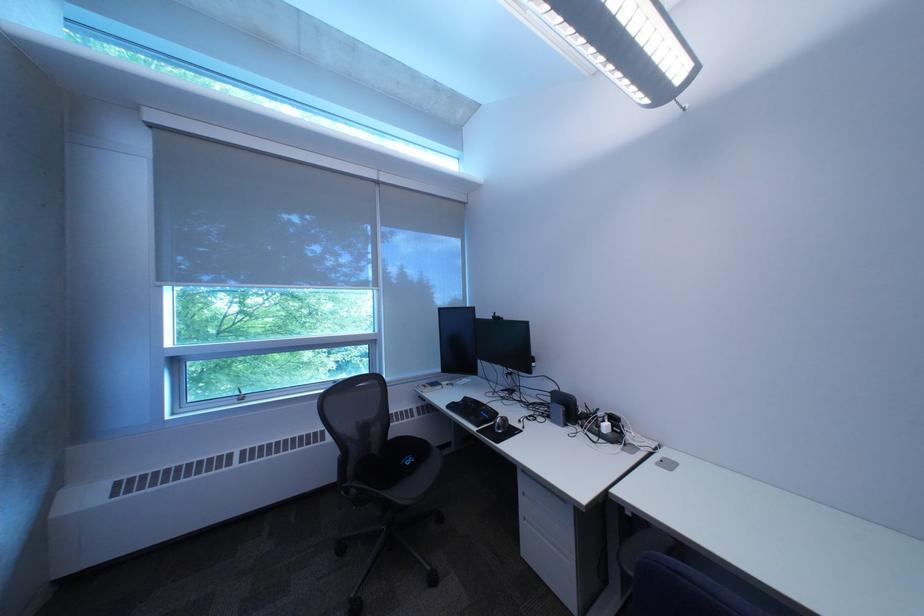
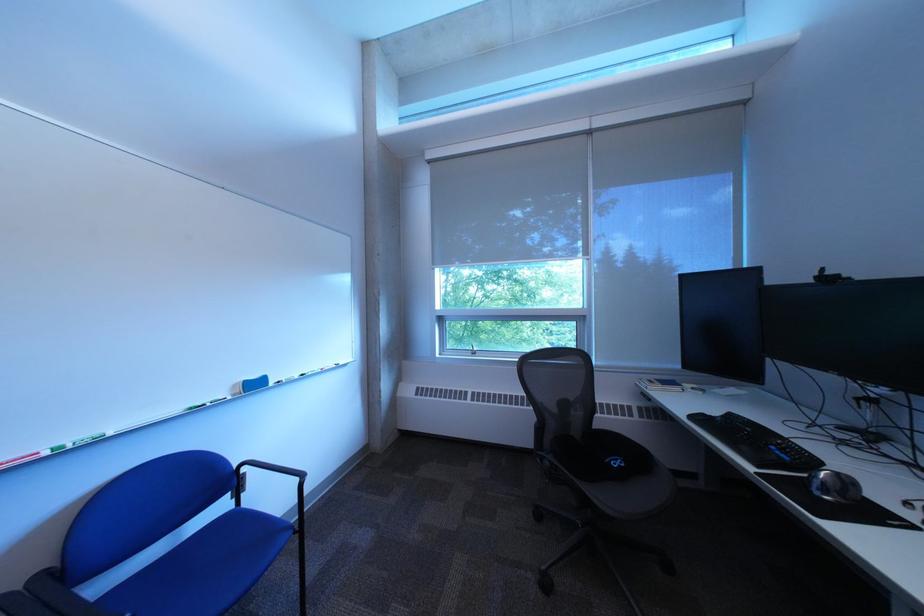
Question: The camera is either moving clockwise (left) or counter-clockwise (right) around the object. The first image is from the beginning of the video and the second image is from the end. Is the camera moving left or right when shooting the video?

Choices:
 (A) Left
 (B) Right

Answer: (B)